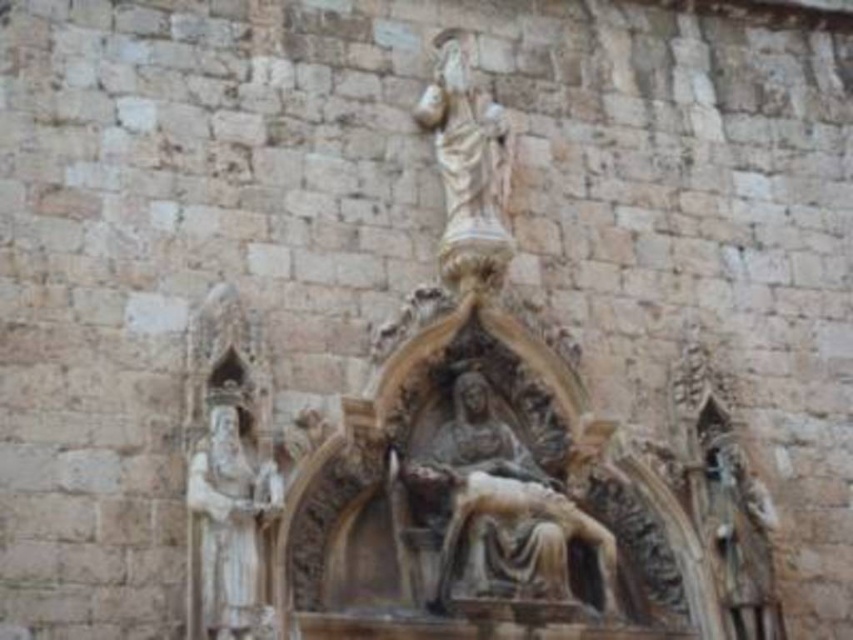
Is point (444, 488) positioned before point (206, 433)?

No, (444, 488) is behind (206, 433).

How much distance is there between polished stone pieta at center and white stone statue at left?

They are 12.24 meters apart.

Between point (548, 595) and point (247, 572), which one is positioned behind?

Point (548, 595)

The height and width of the screenshot is (640, 853). What are the coordinates of `polished stone pieta at center` in the screenshot? It's located at (498, 509).